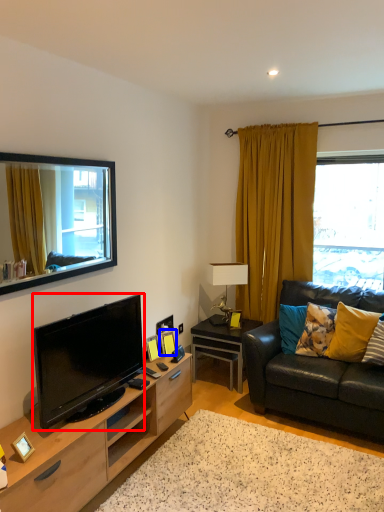
Question: Which of the following is the closest to the observer, television (highlighted by a red box) or picture frame (highlighted by a blue box)?

Choices:
 (A) television
 (B) picture frame

Answer: (A)